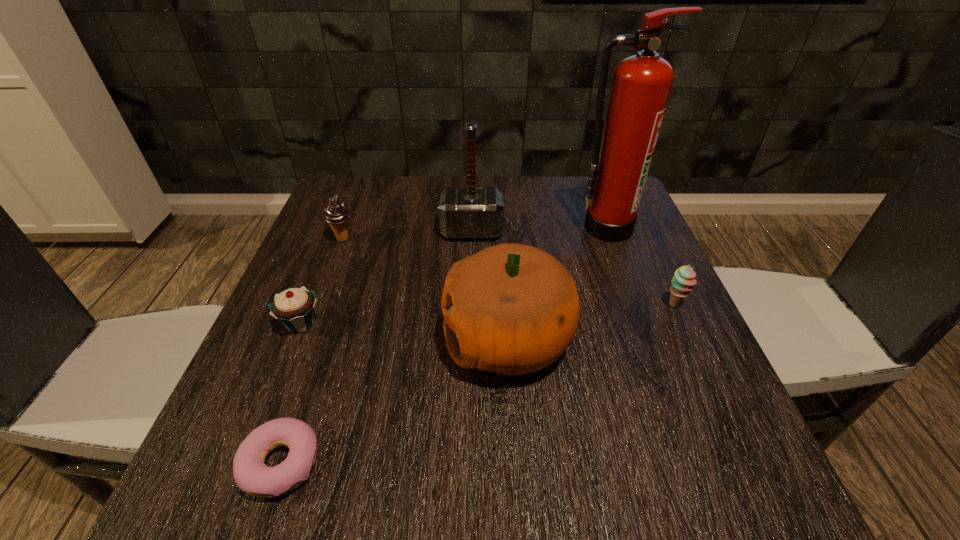
Locate which object is the closest to the sherbert. Please provide its 2D coordinates. Your answer should be formatted as a tuple, i.e. [(x, y)], where the tuple contains the x and y coordinates of a point satisfying the conditions above.

[(641, 85)]

You are a GUI agent. You are given a task and a screenshot of the screen. Output one action in this format:
    pyautogui.click(x=<x>, y=<y>)
    Task: Click on the vacant space that satisfies the following two spatial constraints: 1. on the back side of the second shortest object; 2. on the right side of the icecream
    This screenshot has height=540, width=960.
    Given the screenshot: What is the action you would take?
    pyautogui.click(x=335, y=238)

Locate an element on the screen. Image resolution: width=960 pixels, height=540 pixels. free spot that satisfies the following two spatial constraints: 1. with the nozzle pointing from the back of the tallest object; 2. on the face of the fifth shortest object is located at coordinates (647, 339).

Locate an element on the screen. free space that satisfies the following two spatial constraints: 1. on the back side of the second tallest object; 2. on the right side of the doughnut is located at coordinates (361, 231).